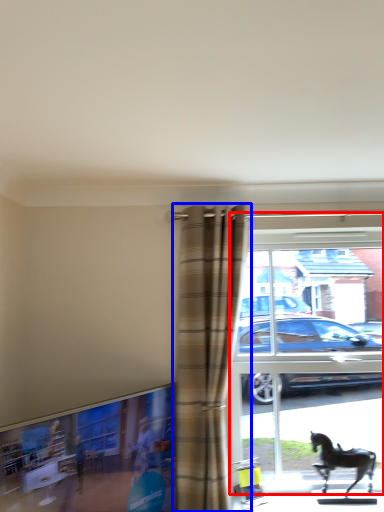
Question: Which object is further to the camera taking this photo, window (highlighted by a red box) or curtain (highlighted by a blue box)?

Choices:
 (A) window
 (B) curtain

Answer: (A)